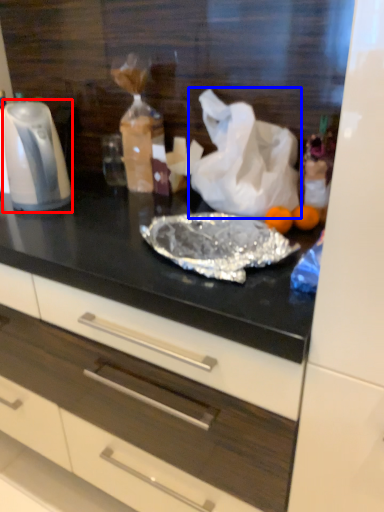
Question: Which point is closer to the camera, kitchen appliance (highlighted by a red box) or plastic bag (highlighted by a blue box)?

Choices:
 (A) kitchen appliance
 (B) plastic bag

Answer: (B)